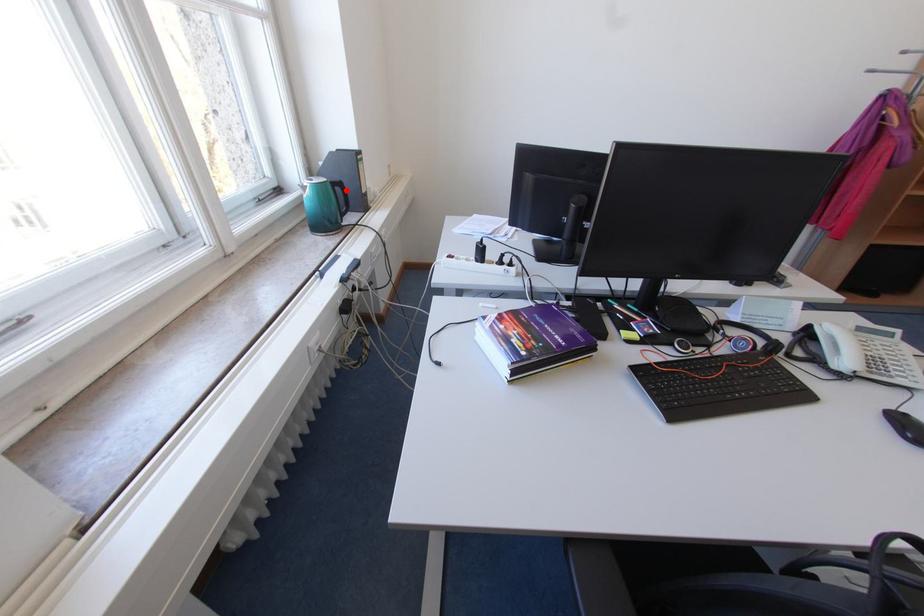
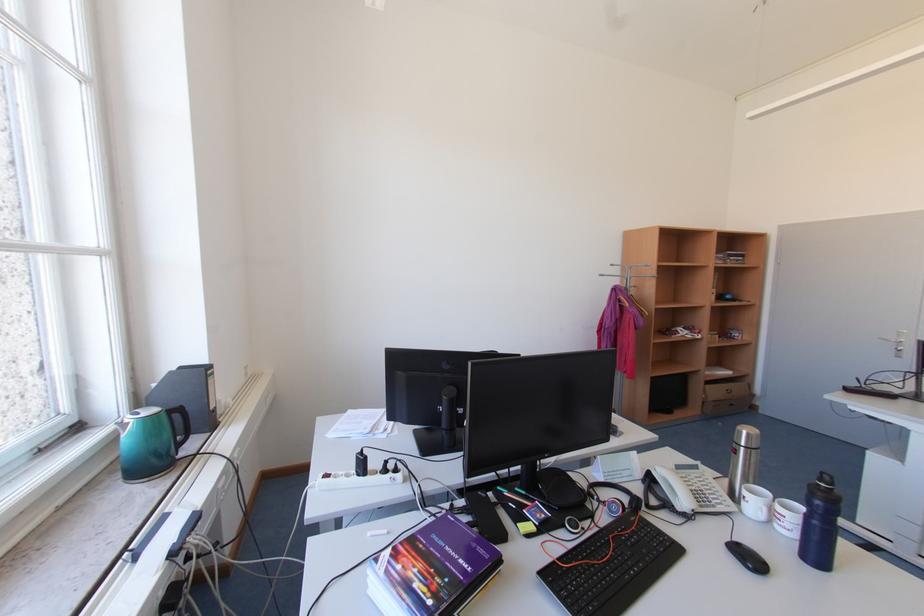
In the second image, find the point that corresponds to the highlighted location in the first image.

(185, 416)